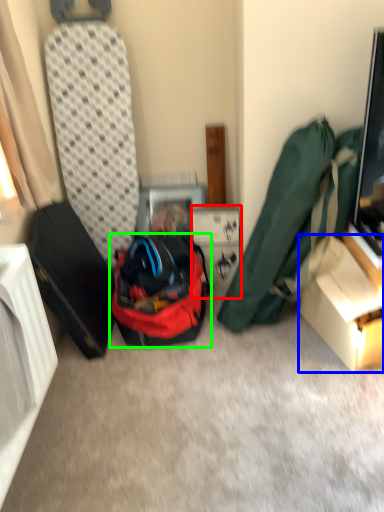
Question: Considering the real-world distances, which object is farthest from cardboard box (highlighted by a red box)? box (highlighted by a blue box) or backpack (highlighted by a green box)?

Choices:
 (A) box
 (B) backpack

Answer: (A)